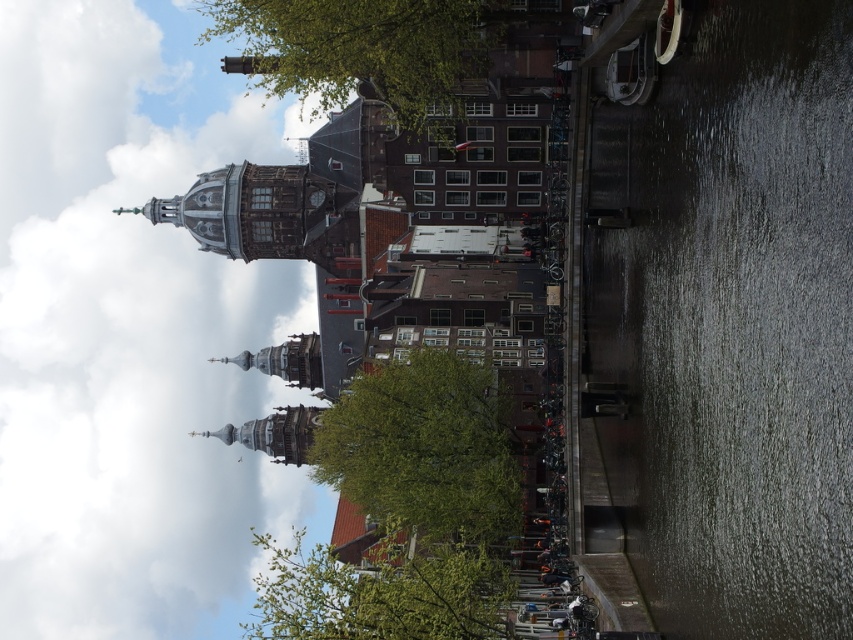
Question: Is dark gray concrete waterway at right thinner than green leafy tree at upper center?

Choices:
 (A) no
 (B) yes

Answer: (B)

Question: Which point is closer to the camera taking this photo?

Choices:
 (A) (461, 628)
 (B) (233, 20)
 (C) (22, 186)
 (D) (436, 368)

Answer: (A)

Question: Which point is farther to the camera?

Choices:
 (A) green leafy tree at lower center
 (B) green leafy tree at upper center
 (C) white fluffy cloud at upper left
 (D) dark gray concrete waterway at right

Answer: (C)

Question: Can you confirm if green leafy tree at upper center is positioned to the right of green leafy tree at lower center?

Choices:
 (A) no
 (B) yes

Answer: (A)

Question: Which of these objects is positioned closest to the green leafy tree at lower center?

Choices:
 (A) dark gray concrete waterway at right
 (B) green leafy tree at center

Answer: (B)

Question: Is white fluffy cloud at upper left positioned in front of green leafy tree at center?

Choices:
 (A) no
 (B) yes

Answer: (A)